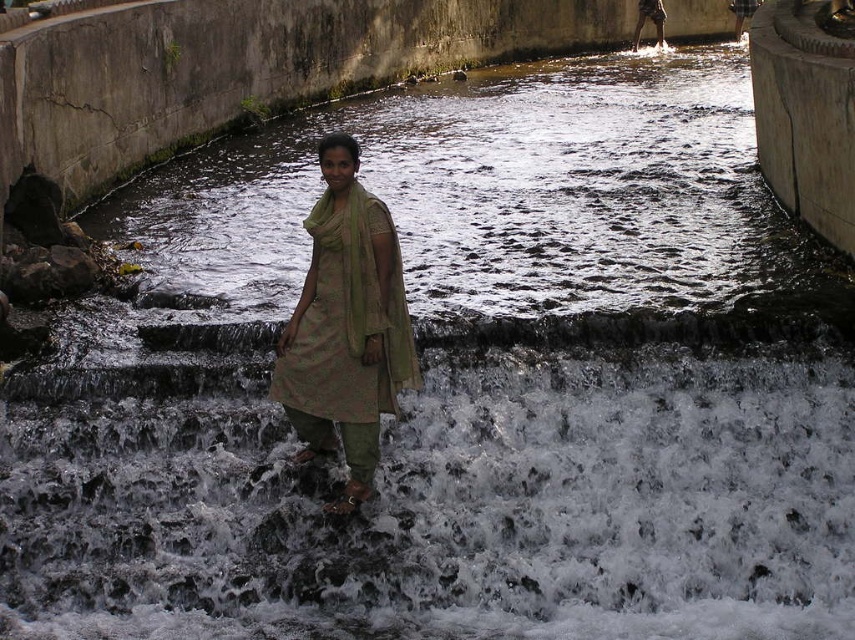
Based on the coordinates provided, where exactly is the dark gray concrete waterway at center located in the image?

The dark gray concrete waterway at center is located at point coordinates of 0.311 on the x axis and 0.580 on the y axis.